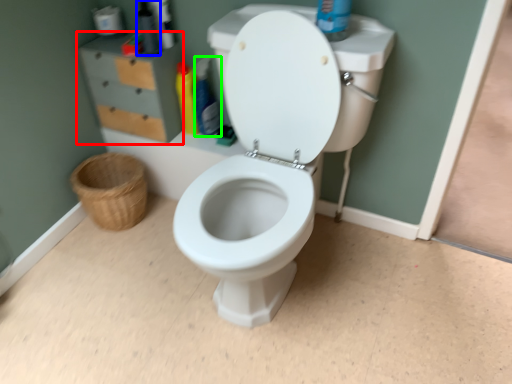
Question: Based on their relative distances, which object is nearer to file cabinet (highlighted by a red box)? Choose from toiletry (highlighted by a blue box) and cleaning product (highlighted by a green box).

Choices:
 (A) toiletry
 (B) cleaning product

Answer: (A)